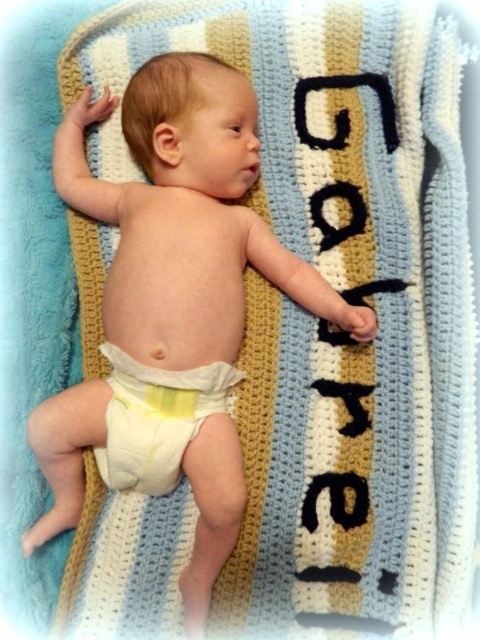
You are a photographer taking a picture of the baby on the crocheted blanket. You notice two points marked on the image at coordinates point (151, 481) and point (129, 371). Which point is closer to the camera?

Point (151, 481) is further to the camera than point (129, 371), so the point closer to the camera is point (129, 371).

You are a photographer taking a picture of a baby lying on a crocheted blanket. The baby has two diapers on, a smooth white diaper at center and a yellow fabric diaper at center. You need to ensure that the distance between the diapers is at least 5 inches to avoid overlapping in the photo. Is the current distance sufficient?

The smooth white diaper at center is 4.37 inches away from the yellow fabric diaper at center. Since 4.37 inches is less than 5 inches, the distance is not sufficient to prevent overlapping in the photo.

Consider the image. You are a photographer taking a picture of the baby. You need to adjust the lighting so that the smooth white diaper at center and the yellow fabric diaper at center are both clearly visible. Which diaper should you focus on first to ensure proper exposure?

The smooth white diaper at center is to the right of the yellow fabric diaper at center. You should focus on the yellow fabric diaper at center first because it has a darker color and might require more light to ensure proper exposure.